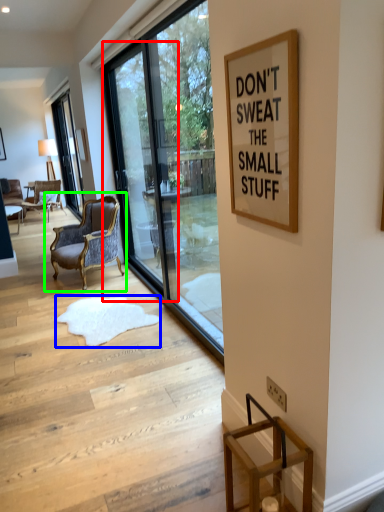
Question: Which object is the closest to the screen door (highlighted by a red box)? Choose among these: doormat (highlighted by a blue box) or chair (highlighted by a green box).

Choices:
 (A) doormat
 (B) chair

Answer: (B)